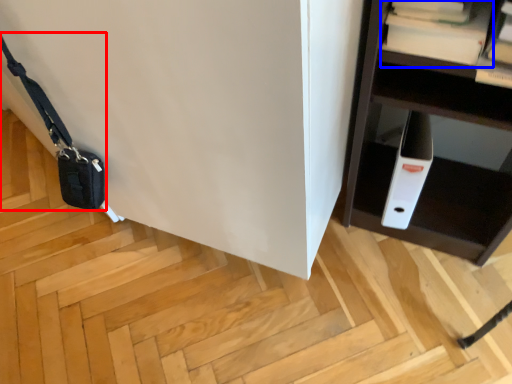
Question: Which of the following is the closest to the observer, messenger bag (highlighted by a red box) or book (highlighted by a blue box)?

Choices:
 (A) messenger bag
 (B) book

Answer: (B)